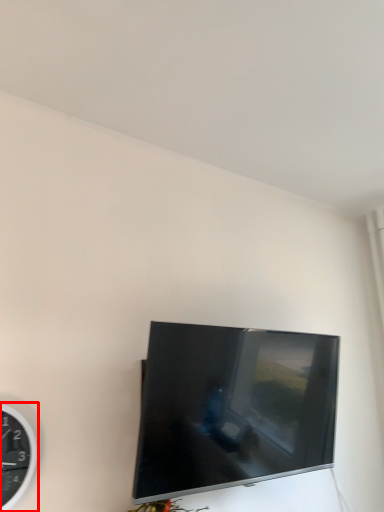
Question: From the image's perspective, considering the relative positions of wall clock (annotated by the red box) and television in the image provided, where is wall clock (annotated by the red box) located with respect to the staircase?

Choices:
 (A) below
 (B) above

Answer: (A)